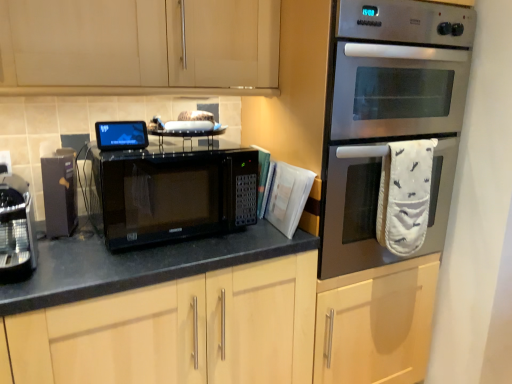
The image size is (512, 384). I want to click on free space that is in between sleek metallic coffee machine at left, the 3th appliance in the right-to-left sequence, and matte black coffee machine at left, the second appliance viewed from the left, so click(x=47, y=249).